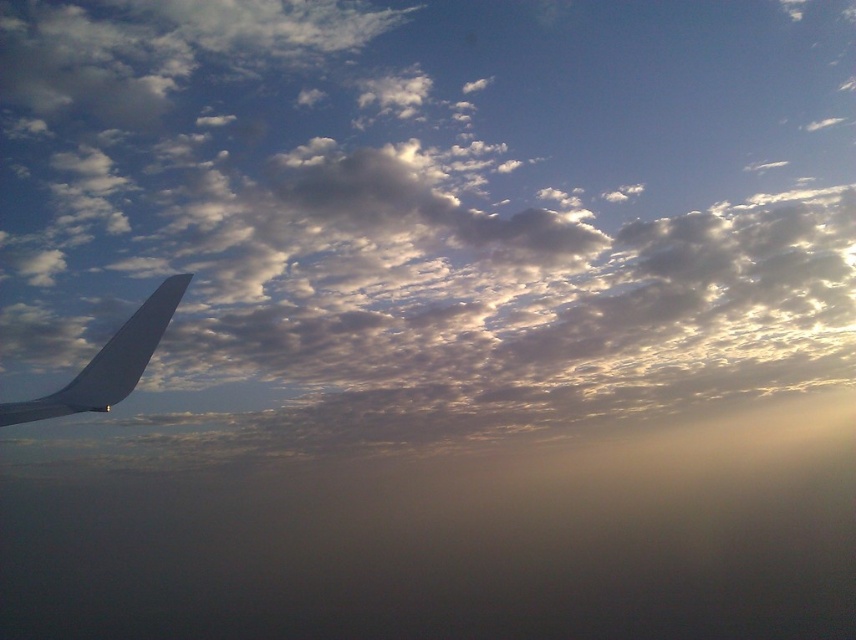
You are a pilot observing the clouds and the wing from the cockpit. Which object, the white fluffy cloud at upper left or the matte gray wing at left, would block more sunlight if positioned directly between the sun and your eyes?

The white fluffy cloud at upper left would block more sunlight because it has a larger size compared to the matte gray wing at left.

You are a pilot observing the scene from the cockpit. You notice the white fluffy cloud at upper left and the matte gray wing at left. Which object appears wider in the view?

The white fluffy cloud at upper left appears wider than the matte gray wing at left because its width surpasses that of the matte gray wing at left.